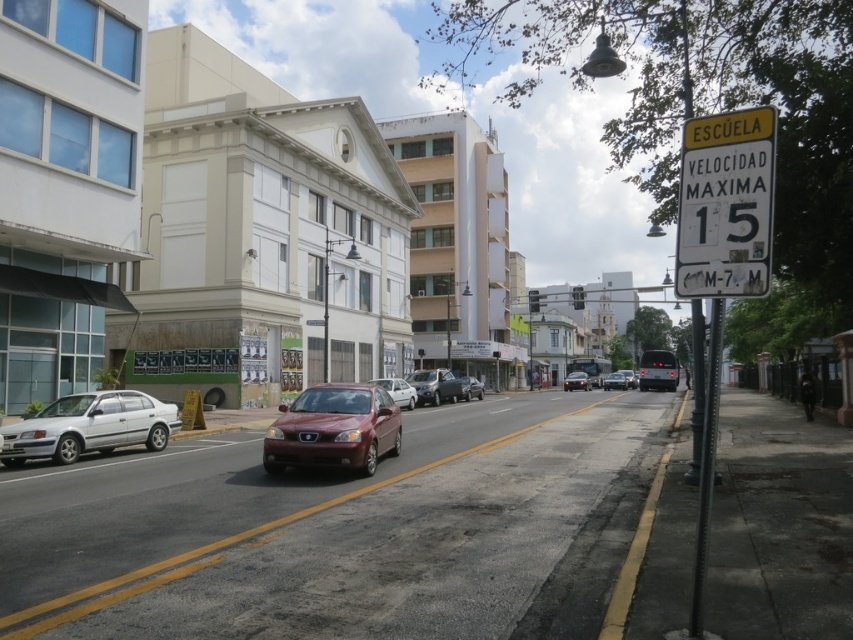
You are a pedestrian standing on the sidewalk on the right side of the street. You see the satin red sedan at center and the matte black van at center. How far apart are these two vehicles from each other?

The satin red sedan at center is 45.93 meters from the matte black van at center.

You are a delivery driver who needs to park your vehicle in a garage that has a height restriction of 5.5 feet. You see a white matte car at center and a matte black sedan at center in the street. Which car would be more likely to exceed the height limit?

The white matte car at center is much taller than the matte black sedan at center, so it would more likely exceed the height limit of 5.5 feet.

You are a delivery driver trying to park your matte red car at center in this urban area. The parking spot you want is at point 0.6, 0.55. Is your car within 0.01 units of the parking spot?

The matte red car at center is located at point (469, 388), which is within 0.01 units of the desired parking spot at (468, 384). Therefore, the car is close enough to the parking spot.